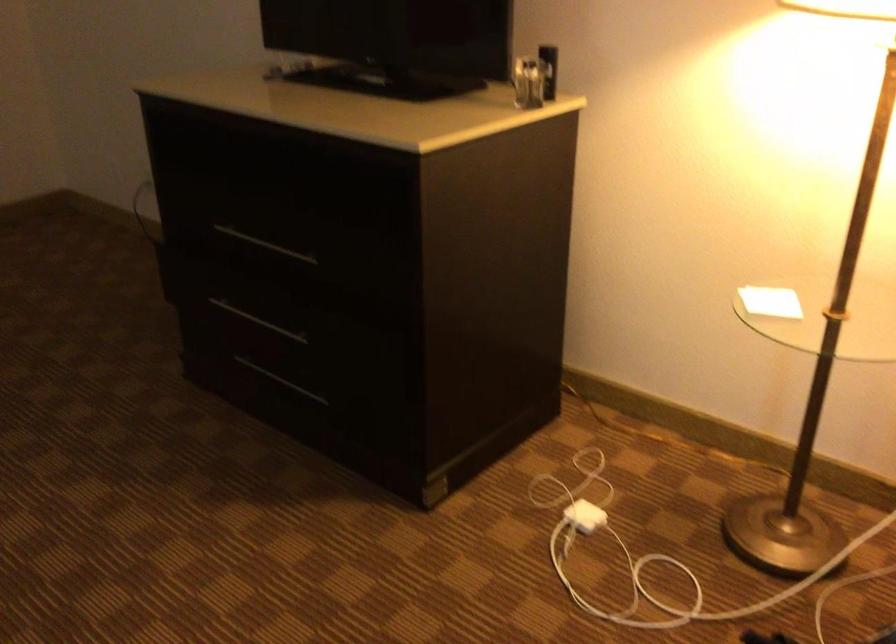
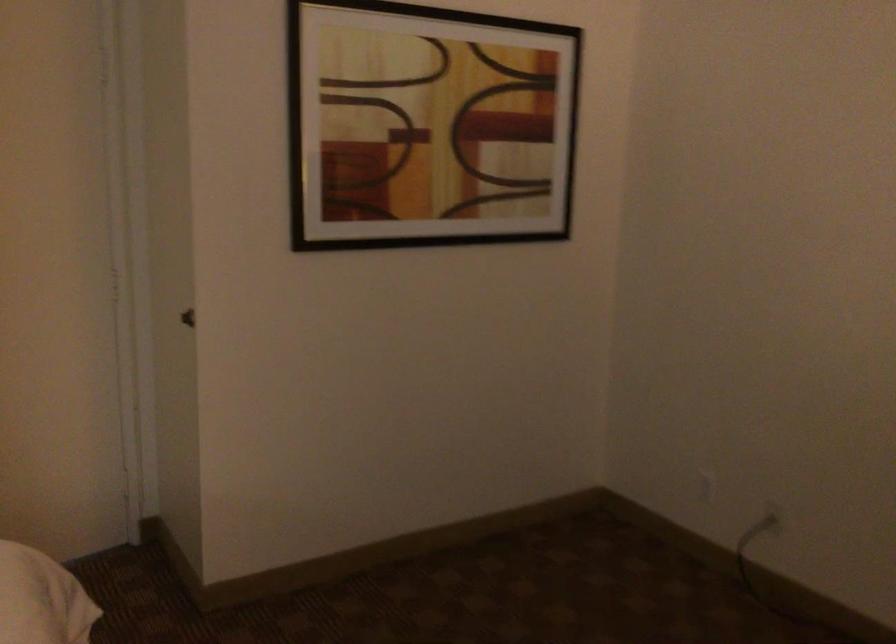
Find the pixel in the second image that matches the point at 117,163 in the first image.

(707, 487)